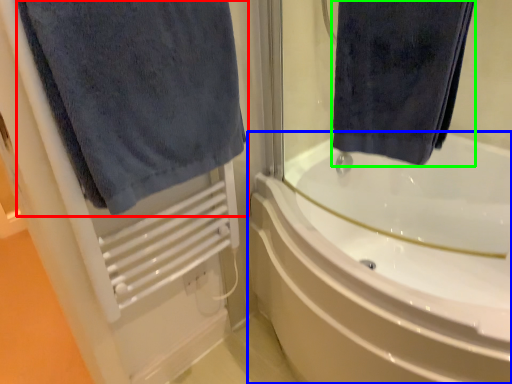
Question: Which object is the farthest from towel (highlighted by a red box)? Choose among these: bathtub (highlighted by a blue box) or towel (highlighted by a green box).

Choices:
 (A) bathtub
 (B) towel

Answer: (A)